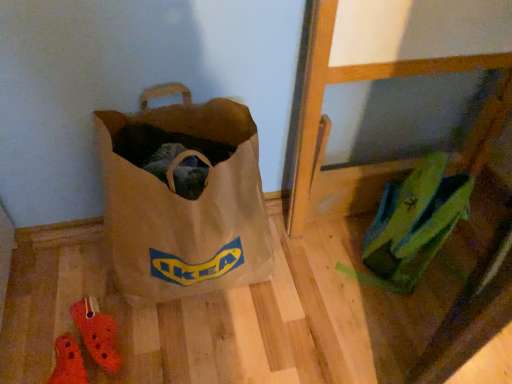
Find the location of `free space to the back side of orange croc at lower left, the second footwear positioned from the bottom`. free space to the back side of orange croc at lower left, the second footwear positioned from the bottom is located at coordinates (115, 297).